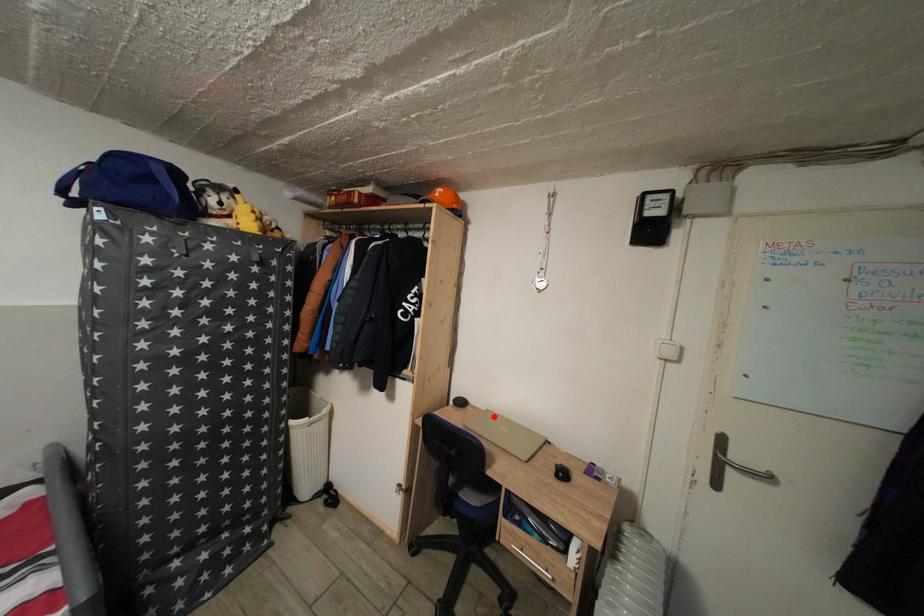
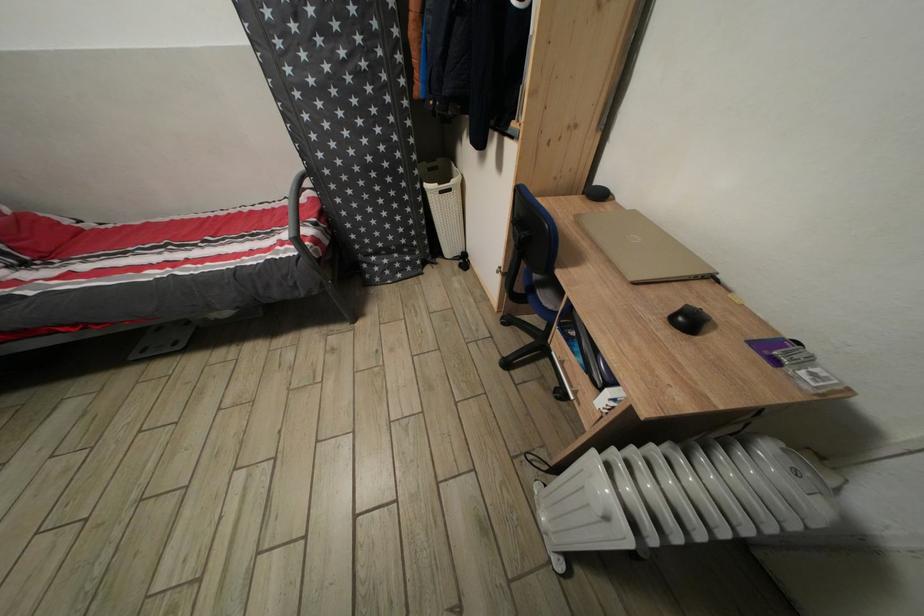
Find the pixel in the second image that matches the highlighted location in the first image.

(641, 217)